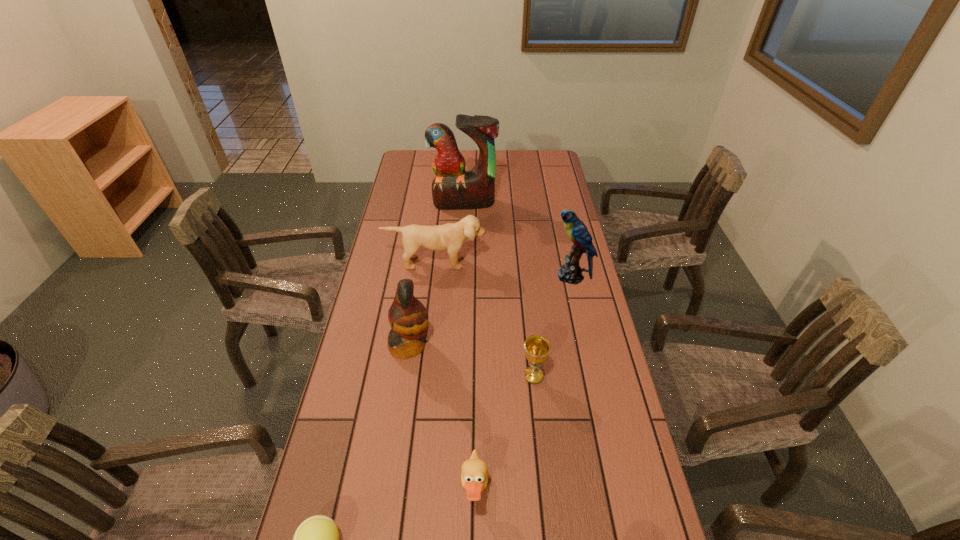
At what (x,y) coordinates should I click in order to perform the action: click on object that is the second closest to the duck. Please return your answer as a coordinate pair (x, y). This screenshot has width=960, height=540. Looking at the image, I should click on (316, 539).

Select which object appears as the fifth closest to the second nearest object. Please provide its 2D coordinates. Your answer should be formatted as a tuple, i.e. [(x, y)], where the tuple contains the x and y coordinates of a point satisfying the conditions above.

[(450, 237)]

Where is `parrot object that ranks as the third closest to the chalice`? parrot object that ranks as the third closest to the chalice is located at coordinates (453, 188).

The width and height of the screenshot is (960, 540). I want to click on parrot that is the closest to the nearest object, so [408, 317].

I want to click on free region that satisfies the following two spatial constraints: 1. on the face of the rightmost parrot; 2. on the front side of the third nearest object, so click(593, 376).

The image size is (960, 540). In order to click on vacant space that satisfies the following two spatial constraints: 1. on the face of the third nearest object; 2. on the right side of the nearest parrot in this screenshot , I will do 405,376.

Image resolution: width=960 pixels, height=540 pixels. Find the location of `free space that satisfies the following two spatial constraints: 1. on the back side of the third nearest object; 2. on the face of the nearest parrot`. free space that satisfies the following two spatial constraints: 1. on the back side of the third nearest object; 2. on the face of the nearest parrot is located at coordinates (530, 346).